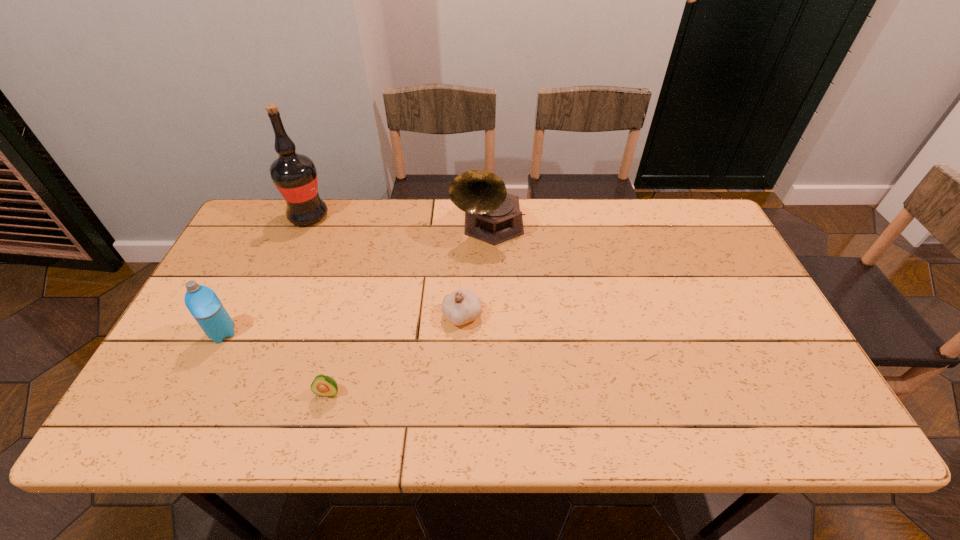
Where is `the tallest object`? This screenshot has width=960, height=540. the tallest object is located at coordinates [295, 176].

Locate an element on the screen. phonograph record is located at coordinates (492, 215).

The height and width of the screenshot is (540, 960). I want to click on thermos bottle, so click(202, 302).

Image resolution: width=960 pixels, height=540 pixels. Identify the location of garlic. (462, 306).

Locate an element on the screen. the shortest object is located at coordinates (323, 385).

This screenshot has width=960, height=540. Find the location of `the nearest object`. the nearest object is located at coordinates [x=323, y=385].

Where is `vacant space situated 0.160m on the right of the wine bottle`? The image size is (960, 540). vacant space situated 0.160m on the right of the wine bottle is located at coordinates (377, 216).

Locate an element on the screen. The height and width of the screenshot is (540, 960). free space located 0.080m on the horn direction of the fourth shortest object is located at coordinates (490, 271).

Locate an element on the screen. The width and height of the screenshot is (960, 540). vacant region located 0.170m on the back of the thermos bottle is located at coordinates (252, 276).

Identify the location of vacant area located on the right of the garlic. This screenshot has height=540, width=960. pyautogui.click(x=627, y=316).